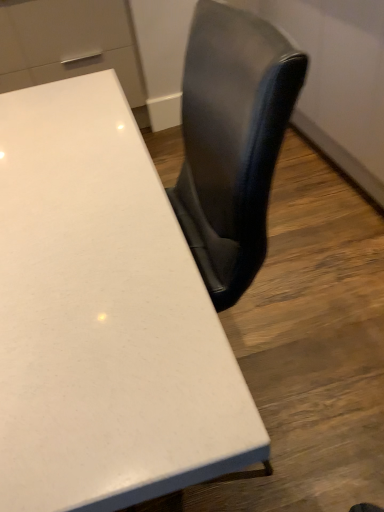
The width and height of the screenshot is (384, 512). Describe the element at coordinates (104, 317) in the screenshot. I see `white glossy table at center` at that location.

Measure the distance between white glossy table at center and camera.

The depth of white glossy table at center is 11.81 inches.

Image resolution: width=384 pixels, height=512 pixels. In order to click on white glossy table at center in this screenshot , I will do `click(104, 317)`.

This screenshot has width=384, height=512. I want to click on white glossy table at center, so coord(104,317).